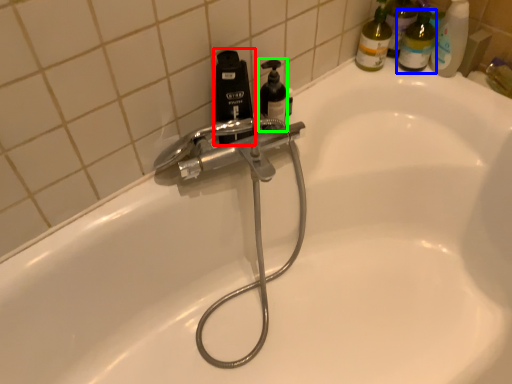
Question: Which is nearer to the bottle (highlighted by a red box)? toiletry (highlighted by a blue box) or soap dispenser (highlighted by a green box).

Choices:
 (A) toiletry
 (B) soap dispenser

Answer: (B)